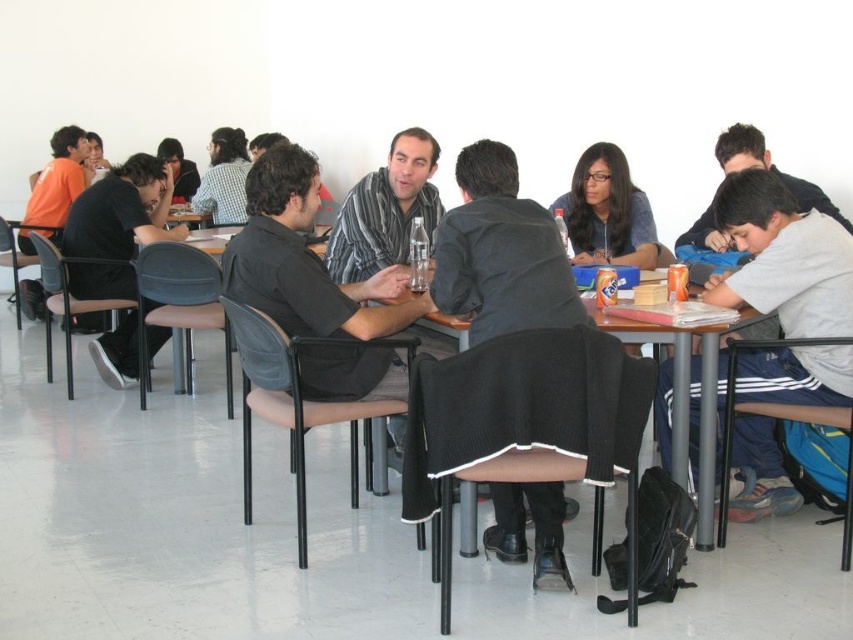
You are sitting at the wooden table at center and want to reach the matte gray sweater at center. Which direction should you move to get it?

The matte gray sweater at center is to the left of the wooden table at center, so you should move to your left to reach it.

You are standing at the center of the room and want to find the black shirt at left. Which direction should you turn to face it?

The black shirt at left is located at coordinate point 0.355 on the x axis and 0.138 on the y axis. Since you are at the center, you should turn to your left to face it.

You are a photographer standing in the room. You need to capture a photo that includes both the dark gray sweater at center and the black shirt at left. Which one will appear taller in the photo?

The dark gray sweater at center is shorter than the black shirt at left, so the black shirt at left will appear taller in the photo.